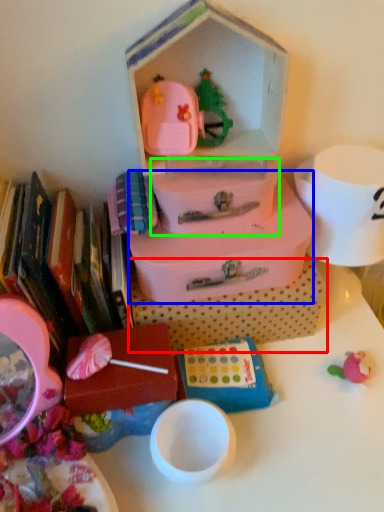
Question: Which object is the closest to the storage box (highlighted by a red box)? Choose among these: storage box (highlighted by a blue box) or storage box (highlighted by a green box).

Choices:
 (A) storage box
 (B) storage box

Answer: (A)